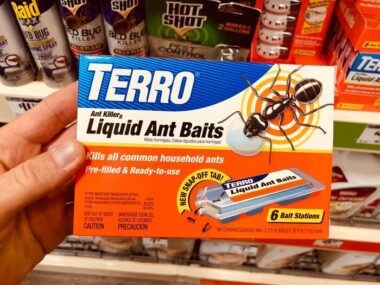
Where is `purple label on white product on shelf`? The width and height of the screenshot is (380, 285). purple label on white product on shelf is located at coordinates (362, 192).